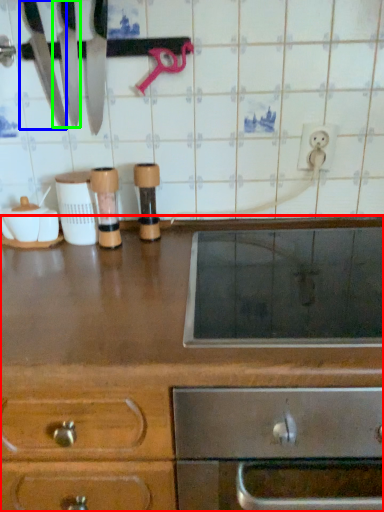
Question: Which is nearer to the cabinetry (highlighted by a red box)? knife (highlighted by a blue box) or knife (highlighted by a green box).

Choices:
 (A) knife
 (B) knife

Answer: (B)